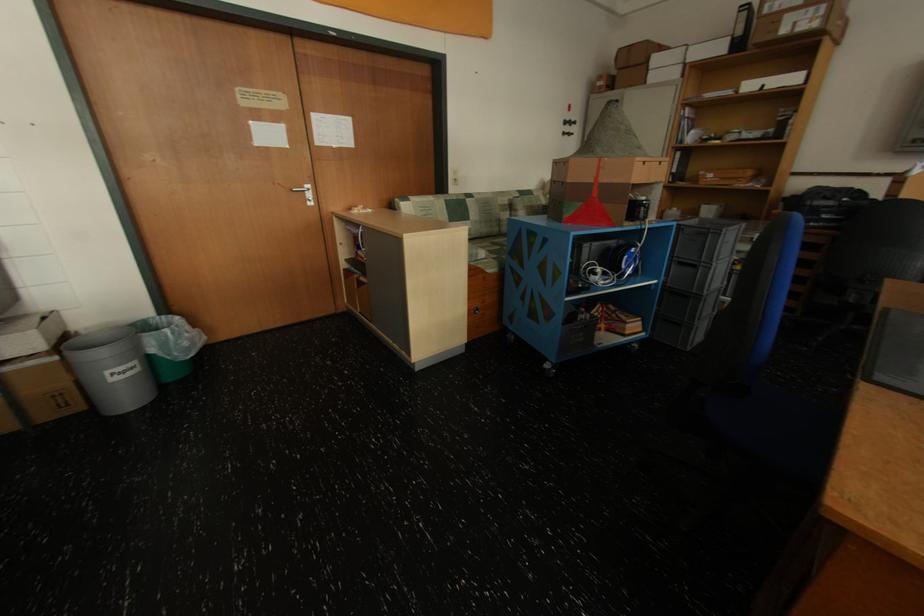
What do you see at coordinates (492, 216) in the screenshot?
I see `the sofa sitting surface` at bounding box center [492, 216].